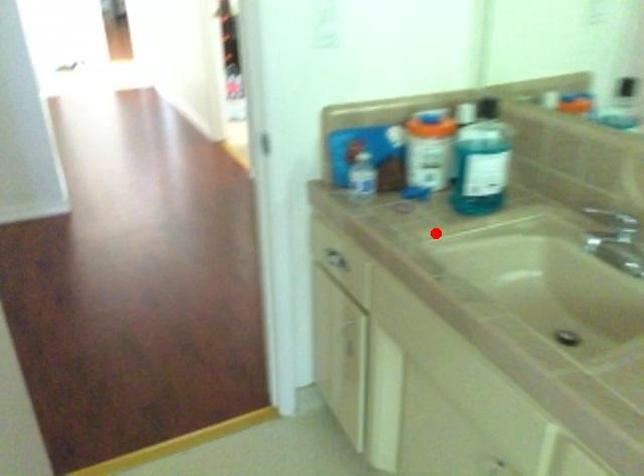
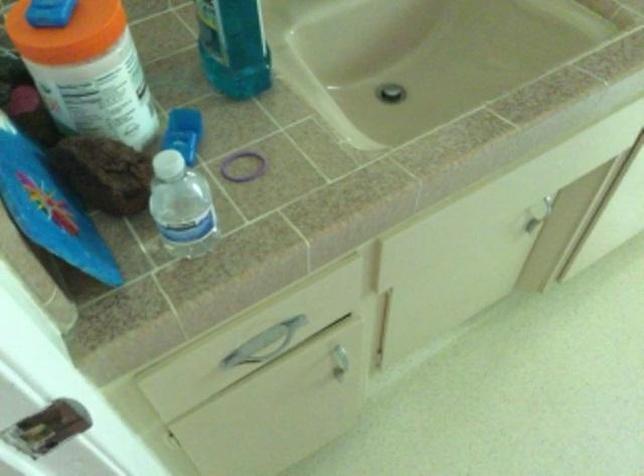
Question: I am providing you with two images of the same scene from different viewpoints. Given a red point in image1, look at the same physical point in image2. Is it:

Choices:
 (A) Closer to the viewpoint
 (B) Farther from the viewpoint

Answer: (A)